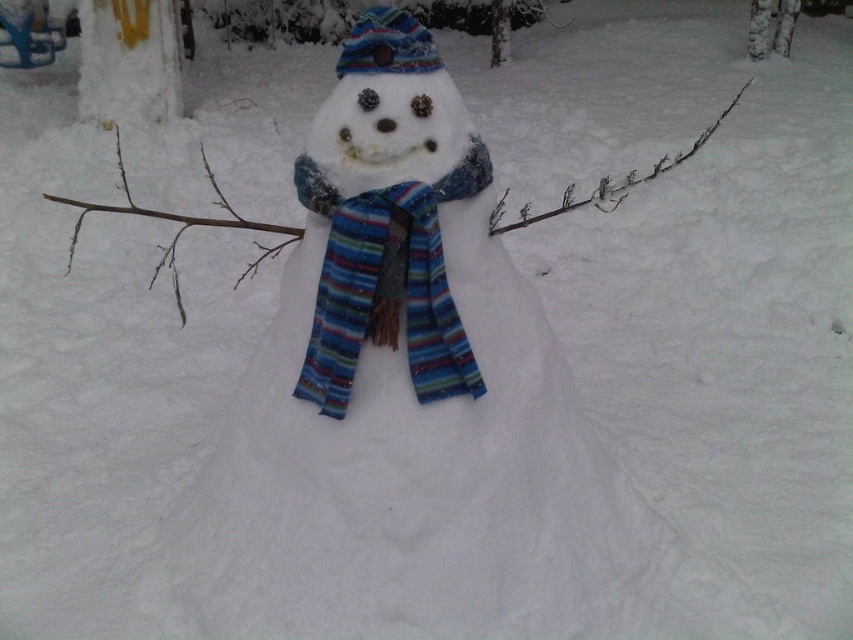
Is striped wool scarf at center positioned before striped woolen hat at center?

Yes.

Does striped wool scarf at center have a greater height compared to striped woolen hat at center?

Correct, striped wool scarf at center is much taller as striped woolen hat at center.

Does point (427, 269) lie in front of point (426, 67)?

Yes, it is.

Where is `striped wool scarf at center`? Image resolution: width=853 pixels, height=640 pixels. striped wool scarf at center is located at coordinates (386, 285).